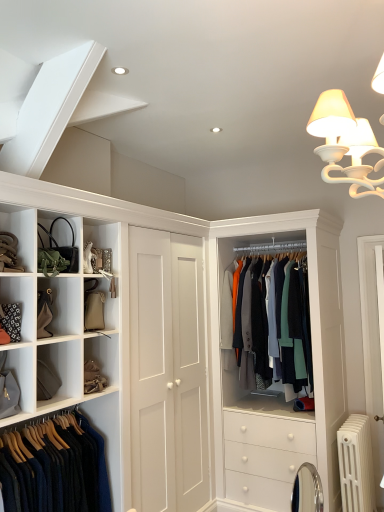
Question: From the image's perspective, relative to matte black handbag at upper left, is textured wool coat at center, which is counted as the 2th clothing, starting from the left, above or below?

Choices:
 (A) below
 (B) above

Answer: (A)

Question: Considering the positions of point (299, 312) and point (72, 251), is point (299, 312) closer or farther from the camera than point (72, 251)?

Choices:
 (A) farther
 (B) closer

Answer: (A)

Question: Based on their relative distances, which object is nearer to the white metallic radiator at lower right?

Choices:
 (A) matte gray bag at lower left
 (B) tan leather belt at upper left
 (C) textured wool coat at center, which ranks as the first clothing in right-to-left order
 (D) dark blue wool sweater at lower left, the first clothing from the left
 (E) matte black handbag at upper left

Answer: (C)

Question: Estimate the real-world distances between objects in this image. Which object is farther from the white metallic radiator at lower right?

Choices:
 (A) matte black handbag at upper left
 (B) dark blue wool sweater at lower left, which ranks as the 2th clothing in back-to-front order
 (C) textured wool coat at center, the 2th clothing positioned from the front
 (D) tan leather belt at upper left
 (E) matte gray bag at lower left

Answer: (D)